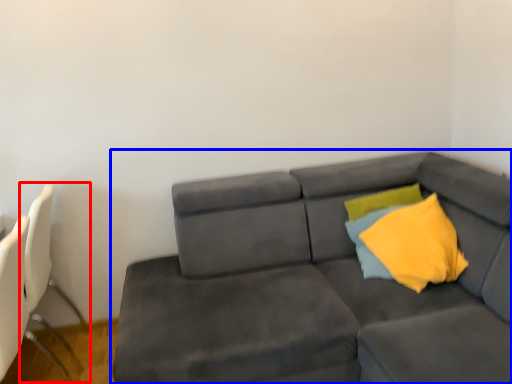
Question: Which object is closer to the camera taking this photo, swivel chair (highlighted by a red box) or studio couch (highlighted by a blue box)?

Choices:
 (A) swivel chair
 (B) studio couch

Answer: (B)